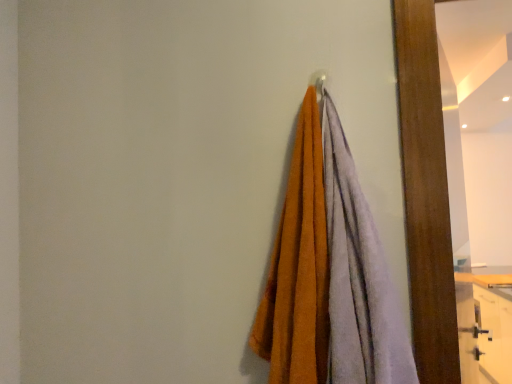
This screenshot has height=384, width=512. Identify the location of wooden mirror at right. (478, 128).

Find the location of a particular element. This screenshot has width=512, height=384. wooden dresser at lower right is located at coordinates (485, 324).

Image resolution: width=512 pixels, height=384 pixels. What do you see at coordinates (328, 273) in the screenshot?
I see `soft cotton towels at center` at bounding box center [328, 273].

I want to click on wooden mirror at right, so click(478, 128).

Are wooden dresser at lower right and soft cotton towels at center beside each other?

No, wooden dresser at lower right is not touching soft cotton towels at center.

Between wooden dresser at lower right and soft cotton towels at center, which one appears on the left side from the viewer's perspective?

Positioned to the left is soft cotton towels at center.

Is soft cotton towels at center located within wooden dresser at lower right?

No, soft cotton towels at center is located outside of wooden dresser at lower right.

Considering the positions of points (470, 275) and (457, 126), is point (470, 275) closer to camera compared to point (457, 126)?

Yes, it is.

How different are the orientations of wooden dresser at lower right and wooden mirror at right in degrees?

wooden dresser at lower right and wooden mirror at right are facing 160 degrees away from each other.

Between wooden dresser at lower right and wooden mirror at right, which one appears on the left side from the viewer's perspective?

wooden mirror at right.

Is wooden mirror at right surrounding wooden dresser at lower right?

Definitely not — wooden dresser at lower right is not inside wooden mirror at right.

Is wooden mirror at right oriented away from wooden dresser at lower right?

No.

In the scene shown: Would you consider wooden mirror at right to be distant from wooden dresser at lower right?

No, wooden mirror at right is in close proximity to wooden dresser at lower right.

Based on the photo, how different are the orientations of wooden mirror at right and wooden dresser at lower right in degrees?

There is a 160-degree angle between the facing directions of wooden mirror at right and wooden dresser at lower right.

Which is in front, soft cotton towels at center or wooden mirror at right?

Positioned in front is soft cotton towels at center.

From a real-world perspective, is soft cotton towels at center on wooden mirror at right?

Correct, in the physical world, soft cotton towels at center is higher than wooden mirror at right.

Looking at the image, does soft cotton towels at center seem bigger or smaller compared to wooden mirror at right?

soft cotton towels at center is smaller than wooden mirror at right.

Can you confirm if soft cotton towels at center is bigger than wooden dresser at lower right?

No, soft cotton towels at center is not bigger than wooden dresser at lower right.

Is wooden dresser at lower right completely or partially inside soft cotton towels at center?

No, wooden dresser at lower right is located outside of soft cotton towels at center.

Is soft cotton towels at center placed right next to wooden dresser at lower right?

There is a gap between soft cotton towels at center and wooden dresser at lower right.

Does soft cotton towels at center have a greater width compared to wooden dresser at lower right?

Incorrect, the width of soft cotton towels at center does not surpass that of wooden dresser at lower right.

Considering the relative sizes of wooden mirror at right and soft cotton towels at center in the image provided, is wooden mirror at right thinner than soft cotton towels at center?

Yes.

Identify the location of towel to the left of wooden mirror at right. (328, 273).

In the scene shown: Who is smaller, wooden mirror at right or soft cotton towels at center?

With smaller size is soft cotton towels at center.

Between point (460, 164) and point (365, 239), which one is positioned in front?

Positioned in front is point (365, 239).

Image resolution: width=512 pixels, height=384 pixels. Find the location of `dresser below the soft cotton towels at center (from a real-world perspective)`. dresser below the soft cotton towels at center (from a real-world perspective) is located at coordinates (485, 324).

I want to click on mirror above the wooden dresser at lower right (from the image's perspective), so click(x=478, y=128).

Considering their positions, is soft cotton towels at center positioned closer to wooden mirror at right than wooden dresser at lower right?

wooden dresser at lower right is positioned closer to the anchor wooden mirror at right.

Based on their spatial positions, is soft cotton towels at center or wooden mirror at right closer to wooden dresser at lower right?

wooden mirror at right lies closer to wooden dresser at lower right than the other object.

Looking at the image, which one is located closer to wooden mirror at right, wooden dresser at lower right or soft cotton towels at center?

Among the two, wooden dresser at lower right is located nearer to wooden mirror at right.

Estimate the real-world distances between objects in this image. Which object is closer to wooden dresser at lower right, wooden mirror at right or soft cotton towels at center?

wooden mirror at right is positioned closer to the anchor wooden dresser at lower right.

Which object lies nearer to the anchor point soft cotton towels at center, wooden dresser at lower right or wooden mirror at right?

The object closer to soft cotton towels at center is wooden mirror at right.

From the image, which object appears to be nearer to soft cotton towels at center, wooden mirror at right or wooden dresser at lower right?

wooden mirror at right is closer to soft cotton towels at center.

Where is `mirror located between soft cotton towels at center and wooden dresser at lower right in the depth direction`? The height and width of the screenshot is (384, 512). mirror located between soft cotton towels at center and wooden dresser at lower right in the depth direction is located at coordinates (478, 128).